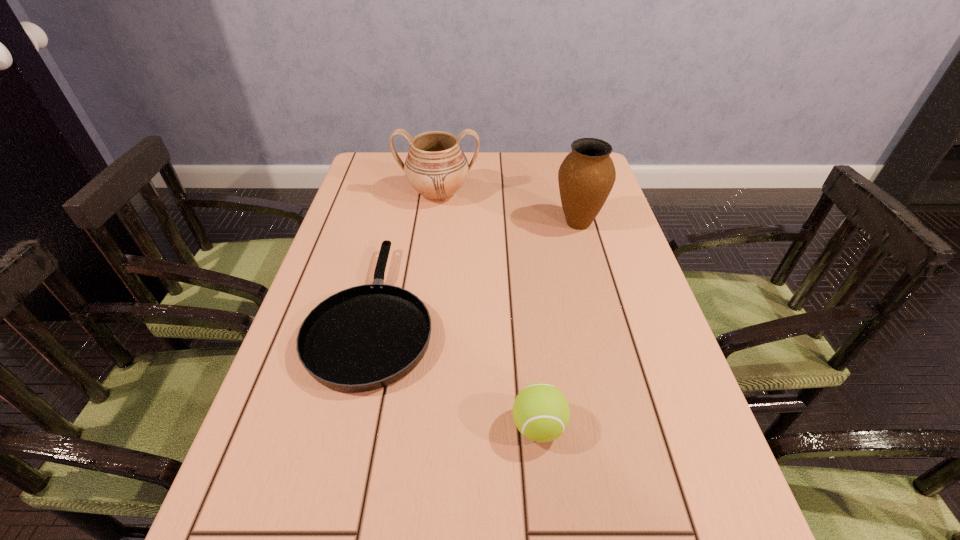
Identify the location of the rightmost object. This screenshot has width=960, height=540. (586, 176).

Where is `the left urn`? the left urn is located at coordinates (436, 167).

I want to click on tennis ball, so click(x=541, y=413).

Image resolution: width=960 pixels, height=540 pixels. Find the location of `the second shortest object`. the second shortest object is located at coordinates (541, 413).

Image resolution: width=960 pixels, height=540 pixels. What are the coordinates of `the shortest object` in the screenshot? It's located at (366, 337).

This screenshot has width=960, height=540. I want to click on frying pan, so point(366,337).

Locate an element on the screen. Image resolution: width=960 pixels, height=540 pixels. free spot located on the front of the rightmost object is located at coordinates (611, 341).

Image resolution: width=960 pixels, height=540 pixels. In order to click on vacant area located on the front-facing side of the left urn in this screenshot , I will do `click(434, 233)`.

The image size is (960, 540). I want to click on vacant space located on the right of the nearest object, so click(688, 427).

What are the coordinates of `vacant space located 0.300m on the handle side of the frying pan` in the screenshot? It's located at (403, 190).